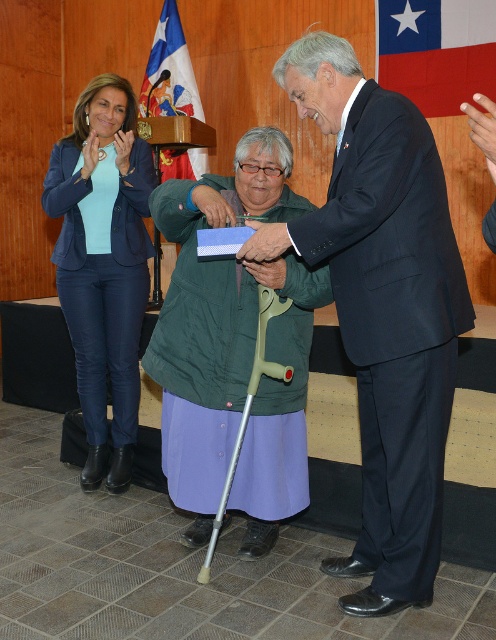
Question: Which object is the closest to the dark blue suit at center?

Choices:
 (A) blue fabric flag at upper center
 (B) matte blue blazer at left

Answer: (B)

Question: Which point is closer to the camera?

Choices:
 (A) red fabric flag at upper right
 (B) matte blue blazer at left
 (C) green fabric crutch at center

Answer: (C)

Question: Can you confirm if dark blue suit at center is positioned to the right of matte blue blazer at left?

Choices:
 (A) yes
 (B) no

Answer: (A)

Question: Which object is farther from the camera taking this photo?

Choices:
 (A) green fabric crutch at center
 (B) matte blue blazer at left
 (C) dark blue suit at center
 (D) blue fabric flag at upper center

Answer: (D)

Question: Is dark blue suit at center thinner than blue fabric flag at upper center?

Choices:
 (A) yes
 (B) no

Answer: (B)

Question: Is green fabric crutch at center wider than matte blue blazer at left?

Choices:
 (A) no
 (B) yes

Answer: (B)